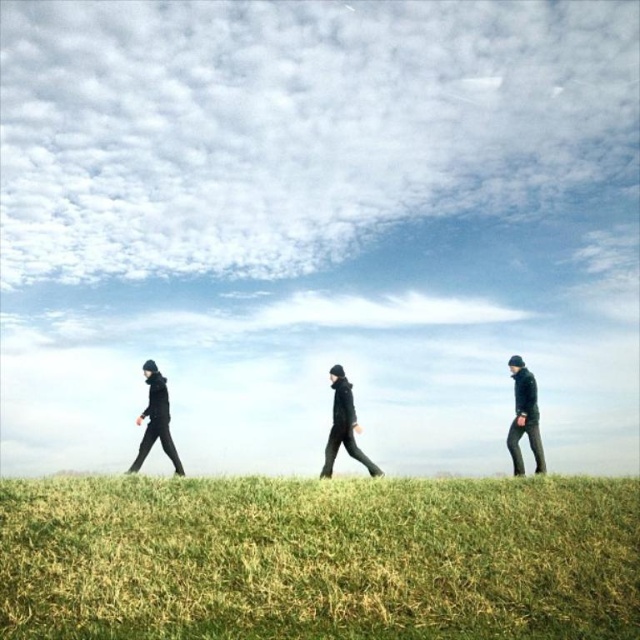
You are a photographer standing on the grassy hill and want to take a photo of the black matte jacket at center and the green grass at lower center. Which object appears taller in the photo?

The black matte jacket at center appears taller than the green grass at lower center in the photo because the green grass at lower center has a lesser height compared to the black matte jacket at center.

You are standing at the edge of the grassy hill and see the green grass at lower center and the dark green pants at right. Which object is closer to your left side?

The green grass at lower center is closer to your left side since it is positioned to the left of the dark green pants at right.

Looking at this image, you are a photographer standing at the center of the grassy hill. You want to capture a photo that includes both the dark green pants at right and the black matte jacket at left. Given that your camera has a maximum field of view of 8 meters, will you be able to fit both subjects into the frame?

The distance between the dark green pants at right and the black matte jacket at left is 9.21 meters, which exceeds the camera field of view of 8 meters. Therefore, you cannot fit both subjects into the frame.